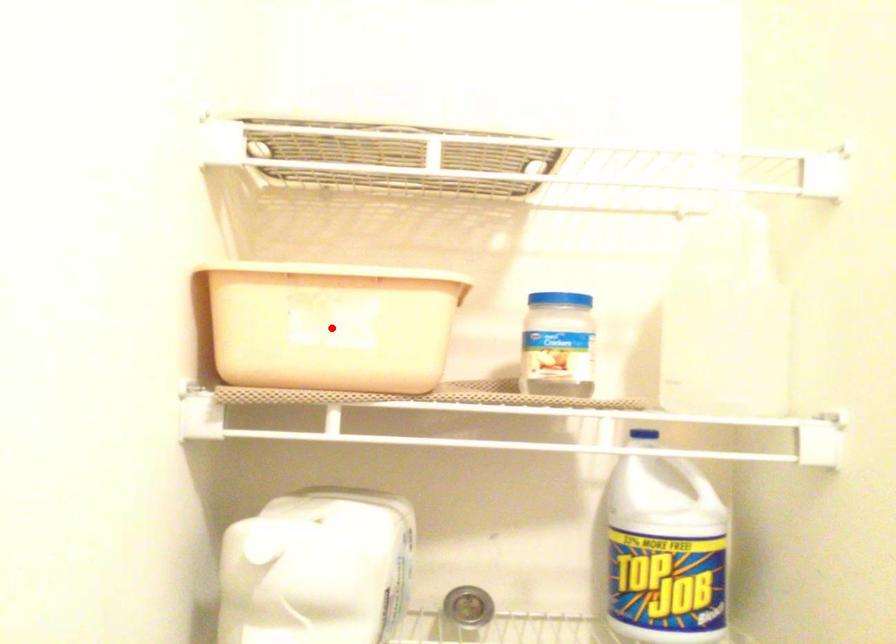
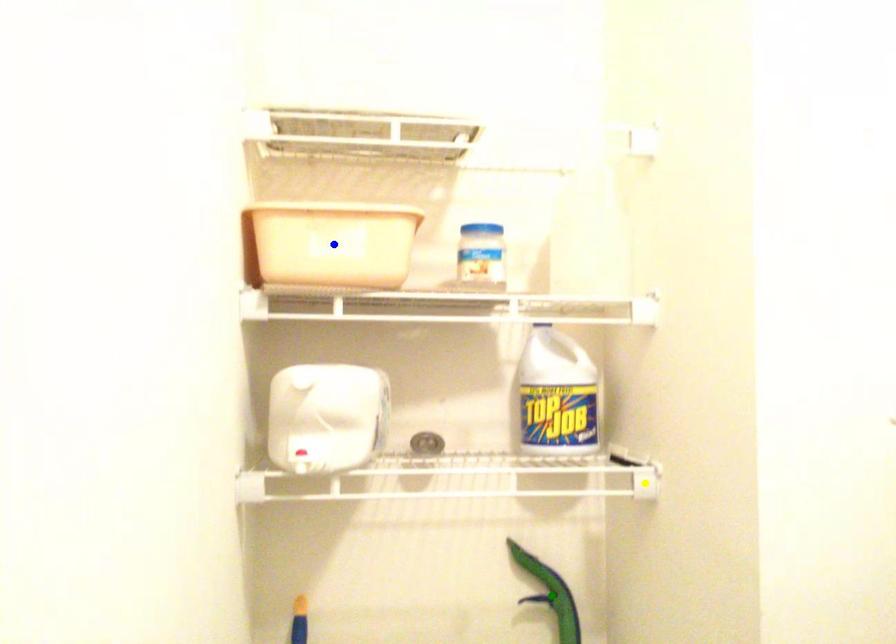
Question: I am providing you with two images of the same scene from different viewpoints. A red point is marked on the first image. You are given multiple points on the second image. Which point in image 2 represents the same 3d spot as the red point in image 1?

Choices:
 (A) blue point
 (B) green point
 (C) yellow point

Answer: (A)